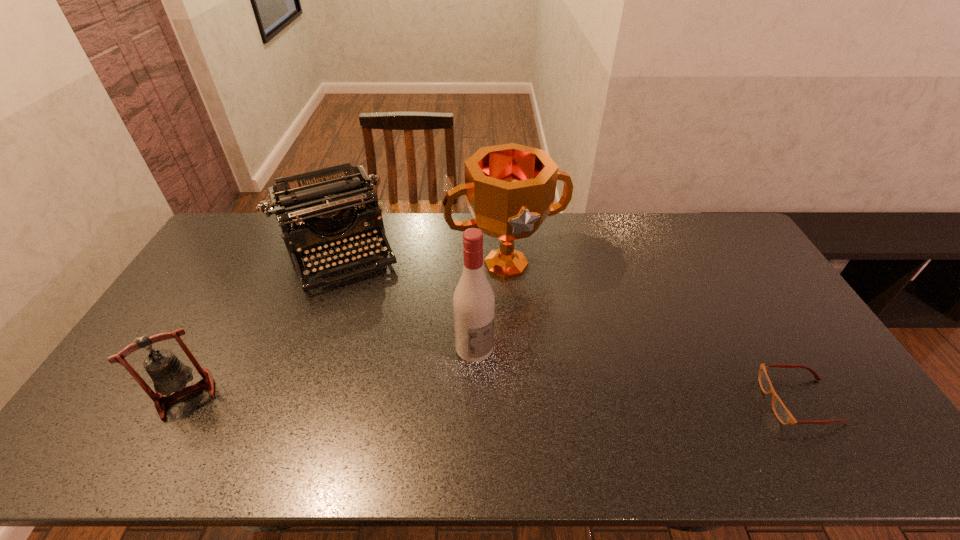
Identify the location of vacant area that lies between the bell and the alcohol. The image size is (960, 540). (330, 371).

Identify the location of vacant area that lies between the award and the bell. (346, 329).

Locate an element on the screen. vacant region between the award and the typewriter is located at coordinates (421, 259).

At what (x,y) coordinates should I click in order to perform the action: click on free space between the alcohol and the spectacles. Please return your answer as a coordinate pair (x, y). Looking at the image, I should click on (636, 375).

Locate an element on the screen. Image resolution: width=960 pixels, height=540 pixels. vacant area between the rightmost object and the typewriter is located at coordinates (568, 327).

What are the coordinates of `unoccupied position between the spectacles and the alcohol` in the screenshot? It's located at (636, 375).

In order to click on vacant point located between the typewriter and the alcohol in this screenshot , I will do `click(405, 300)`.

This screenshot has width=960, height=540. Identify the location of blank region between the shortest object and the award. (653, 333).

Find the location of a particular element. empty location between the shortest object and the typewriter is located at coordinates (568, 327).

Choose which object is the fourth nearest neighbor to the typewriter. Please provide its 2D coordinates. Your answer should be formatted as a tuple, i.e. [(x, y)], where the tuple contains the x and y coordinates of a point satisfying the conditions above.

[(782, 413)]